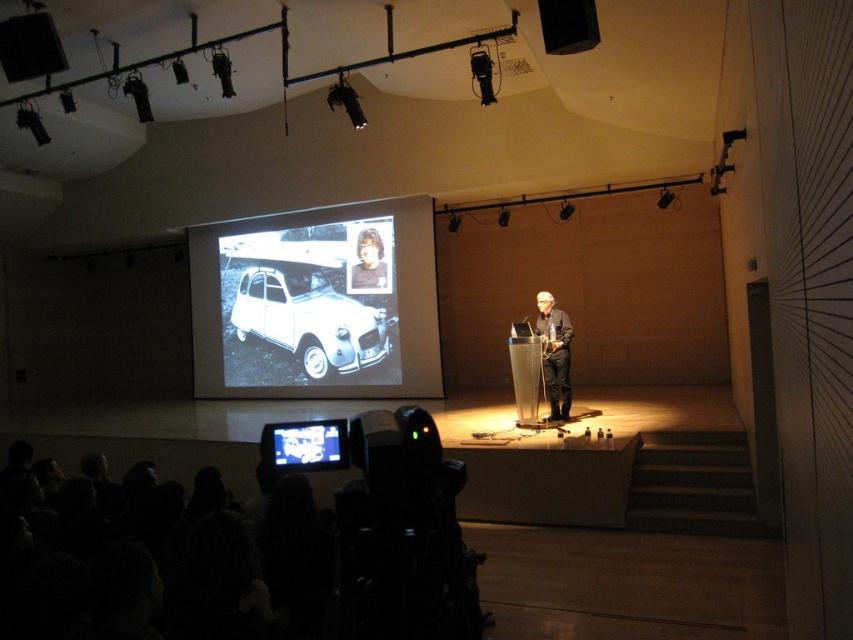
Question: Is black matte projection screen at center bigger than white matte car at center?

Choices:
 (A) no
 (B) yes

Answer: (B)

Question: Which object is closer to the camera taking this photo?

Choices:
 (A) black matte speaker at upper right
 (B) black matte projection screen at center
 (C) matte black speaker at upper left

Answer: (A)

Question: From the image, what is the correct spatial relationship of matte black speaker at upper left in relation to black fabric person at center?

Choices:
 (A) below
 (B) above

Answer: (B)

Question: Which object is positioned farthest from the smooth skin face at center?

Choices:
 (A) black matte projection screen at center
 (B) white matte car at center

Answer: (A)

Question: Which object is positioned farthest from the black fabric person at center?

Choices:
 (A) smooth skin face at center
 (B) matte black speaker at upper left
 (C) black matte speaker at upper right

Answer: (B)

Question: Does black fabric person at center appear on the right side of smooth skin face at center?

Choices:
 (A) no
 (B) yes

Answer: (B)